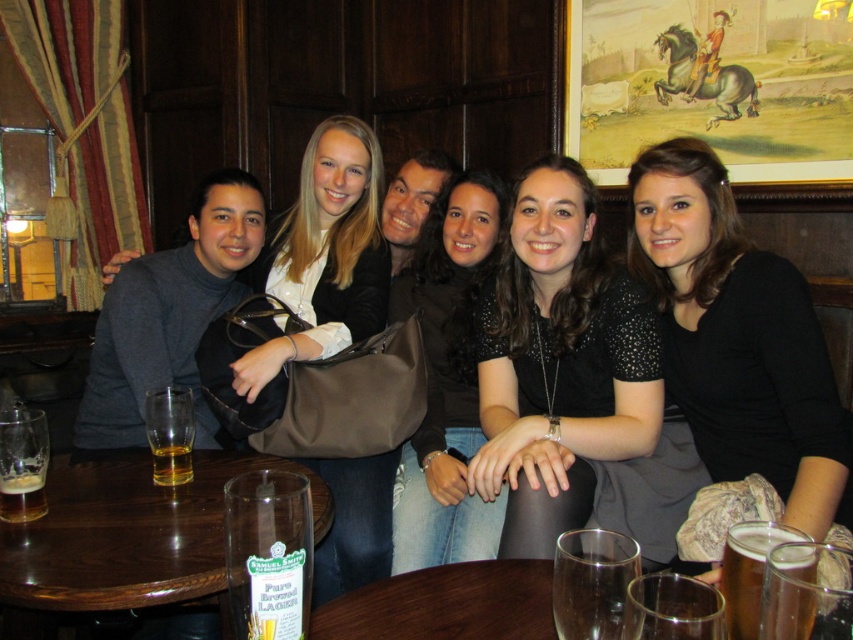
Can you confirm if brown wooden table at lower left is taller than translucent glass beer at table left?

Yes.

Is point (76, 468) behind point (165, 452)?

Yes, point (76, 468) is behind point (165, 452).

Locate an element on the screen. The image size is (853, 640). brown wooden table at lower left is located at coordinates (129, 536).

The image size is (853, 640). What are the coordinates of `brown wooden table at lower left` in the screenshot? It's located at (129, 536).

Between black sparkly shirt at center and translucent glass beer at table left, which one has less height?

translucent glass beer at table left is shorter.

Describe the element at coordinates (738, 339) in the screenshot. Image resolution: width=853 pixels, height=640 pixels. I see `black sparkly shirt at center` at that location.

I want to click on black sparkly shirt at center, so click(738, 339).

Between brown wooden table at lower left and amber glass beer at lower right, which one has more height?

brown wooden table at lower left is taller.

Is brown wooden table at lower left below amber glass beer at lower right?

Indeed, brown wooden table at lower left is positioned under amber glass beer at lower right.

Who is more forward, (148, 600) or (724, 584)?

Point (724, 584)

In order to click on brown wooden table at lower left in this screenshot , I will do `click(129, 536)`.